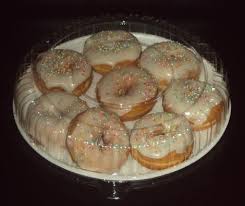
The width and height of the screenshot is (245, 206). I want to click on plate, so click(x=160, y=172).